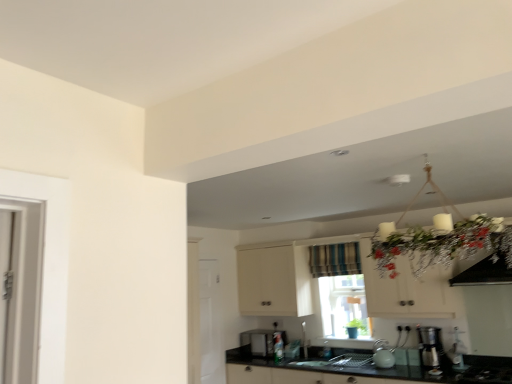
Question: Can you confirm if white matte cabinet at upper center is shorter than black glass gas stove at lower right?

Choices:
 (A) yes
 (B) no

Answer: (B)

Question: From a real-world perspective, does white matte cabinet at upper center sit lower than black glass gas stove at lower right?

Choices:
 (A) no
 (B) yes

Answer: (A)

Question: Does white matte cabinet at upper center have a greater height compared to black glass gas stove at lower right?

Choices:
 (A) no
 (B) yes

Answer: (B)

Question: Does white matte cabinet at upper center have a lesser width compared to black glass gas stove at lower right?

Choices:
 (A) yes
 (B) no

Answer: (A)

Question: Considering the relative positions of white matte cabinet at upper center and black glass gas stove at lower right in the image provided, is white matte cabinet at upper center to the left of black glass gas stove at lower right from the viewer's perspective?

Choices:
 (A) no
 (B) yes

Answer: (B)

Question: Is white matte cabinet at upper center positioned with its back to black glass gas stove at lower right?

Choices:
 (A) yes
 (B) no

Answer: (B)

Question: Does satin black microwave at lower center, which is counted as the second appliance, starting from the front, lie in front of black granite countertop at lower center?

Choices:
 (A) yes
 (B) no

Answer: (B)

Question: From a real-world perspective, is satin black microwave at lower center, which is counted as the first appliance, starting from the bottom, over black granite countertop at lower center?

Choices:
 (A) yes
 (B) no

Answer: (A)

Question: Considering the relative sizes of satin black microwave at lower center, marked as the first appliance in a left-to-right arrangement, and black granite countertop at lower center in the image provided, is satin black microwave at lower center, marked as the first appliance in a left-to-right arrangement, shorter than black granite countertop at lower center?

Choices:
 (A) no
 (B) yes

Answer: (B)

Question: Could you tell me if satin black microwave at lower center, which is the 1th appliance from back to front, is facing black granite countertop at lower center?

Choices:
 (A) yes
 (B) no

Answer: (B)

Question: Is satin black microwave at lower center, marked as the first appliance in a left-to-right arrangement, not inside black granite countertop at lower center?

Choices:
 (A) yes
 (B) no

Answer: (B)

Question: Is satin black microwave at lower center, which is counted as the second appliance, starting from the front, looking in the opposite direction of black granite countertop at lower center?

Choices:
 (A) yes
 (B) no

Answer: (B)

Question: Is black glass gas stove at lower right positioned beyond the bounds of white matte cabinet at upper center?

Choices:
 (A) yes
 (B) no

Answer: (A)